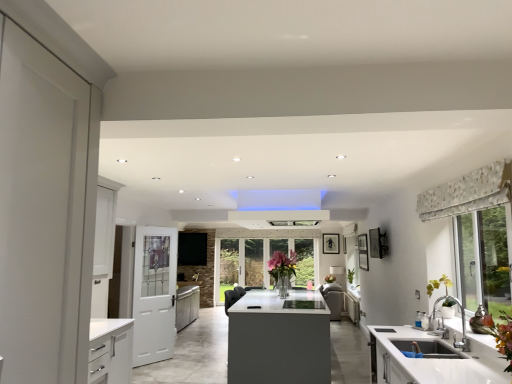
Locate an element on the screen. clear glass vase at center is located at coordinates (283, 285).

What do you see at coordinates (424, 359) in the screenshot? I see `white glossy sink at lower right` at bounding box center [424, 359].

The image size is (512, 384). What do you see at coordinates (154, 294) in the screenshot?
I see `white matte door at left` at bounding box center [154, 294].

I want to click on white matte door at left, so click(x=154, y=294).

You are a GUI agent. You are given a task and a screenshot of the screen. Output one action in this format:
    pyautogui.click(x=<x>, y=<y>)
    Task: Click on the white glossy cabinet at center
    
    Given the screenshot: What is the action you would take?
    pyautogui.click(x=352, y=307)

Measure the distance from green matte plant at right to patterned fabric valance at upper right.

3.41 feet.

At what (x,y) coordinates should I click in order to perform the action: click on curtain in front of the green matte plant at right. Please return your answer as a coordinate pair (x, y). Image resolution: width=512 pixels, height=384 pixels. Looking at the image, I should click on (468, 192).

Is green matte plant at right located outside patterned fabric valance at upper right?

green matte plant at right is positioned outside patterned fabric valance at upper right.

Which is in front, point (448, 305) or point (418, 194)?

The point (448, 305) is closer.

What's the angular difference between patterned fabric valance at upper right and clear glass vase at center's facing directions?

They differ by 0.958 degrees in their facing directions.

Does patterned fabric valance at upper right turn towards clear glass vase at center?

No, patterned fabric valance at upper right is not facing towards clear glass vase at center.

Which of these two, patterned fabric valance at upper right or clear glass vase at center, is smaller?

With smaller size is patterned fabric valance at upper right.

In the scene shown: Is patterned fabric valance at upper right inside the boundaries of clear glass vase at center, or outside?

patterned fabric valance at upper right is outside clear glass vase at center.

In the image, is white glossy cabinet at center on the left side or the right side of clear glass vase at center?

From the image, it's evident that white glossy cabinet at center is to the right of clear glass vase at center.

How many degrees apart are the facing directions of white glossy cabinet at center and clear glass vase at center?

1.69 degrees separate the facing orientations of white glossy cabinet at center and clear glass vase at center.

From the image's perspective, who appears lower, white glossy cabinet at center or clear glass vase at center?

white glossy cabinet at center is shown below in the image.

Does point (349, 303) come in front of point (283, 284)?

That is True.

From the image's perspective, is clear glass vase at center on top of green matte plant at right?

Incorrect, from the image's perspective, clear glass vase at center is lower than green matte plant at right.

Between point (287, 295) and point (445, 283), which one is positioned in front?

The point (445, 283) is closer.

From a real-world perspective, is clear glass vase at center physically below green matte plant at right?

Yes, from a real-world perspective, clear glass vase at center is below green matte plant at right.

Locate an element on the screen. Image resolution: width=512 pixels, height=384 pixels. vase that is under the green matte plant at right (from a real-world perspective) is located at coordinates (283, 285).

Is patterned fabric valance at upper right behind white glossy sink at lower right?

No, patterned fabric valance at upper right is in front of white glossy sink at lower right.

Considering the relative sizes of patterned fabric valance at upper right and white glossy sink at lower right in the image provided, is patterned fabric valance at upper right wider than white glossy sink at lower right?

Incorrect, the width of patterned fabric valance at upper right does not surpass that of white glossy sink at lower right.

This screenshot has width=512, height=384. Find the location of `curtain above the white glossy sink at lower right (from a real-world perspective)`. curtain above the white glossy sink at lower right (from a real-world perspective) is located at coordinates (468, 192).

From a real-world perspective, which is physically below, patterned fabric valance at upper right or white glossy sink at lower right?

From a 3D spatial view, white glossy sink at lower right is below.

Image resolution: width=512 pixels, height=384 pixels. Find the location of `vase on the left of the green matte plant at right`. vase on the left of the green matte plant at right is located at coordinates (283, 285).

Based on their sizes in the image, would you say green matte plant at right is bigger or smaller than clear glass vase at center?

green matte plant at right is smaller than clear glass vase at center.

Which object is positioned more to the right, green matte plant at right or clear glass vase at center?

green matte plant at right.

Is point (349, 312) less distant than point (451, 304)?

That is False.

From a real-world perspective, which object rests below the other?

white glossy cabinet at center, from a real-world perspective.

Is white glossy cabinet at center not close to green matte plant at right?

Indeed, white glossy cabinet at center is not near green matte plant at right.

Identify the location of curtain above the green matte plant at right (from a real-world perspective). point(468,192).

You are a GUI agent. You are given a task and a screenshot of the screen. Output one action in this format:
    pyautogui.click(x=<x>, y=<y>)
    Task: Click on the curtain in front of the clear glass vase at center
    The width and height of the screenshot is (512, 384).
    Given the screenshot: What is the action you would take?
    pyautogui.click(x=468, y=192)

From the image, which object appears to be nearer to white glossy sink at lower right, patterned fabric valance at upper right or clear glass vase at center?

patterned fabric valance at upper right.

Which object lies further to the anchor point white glossy cabinet at center, white matte door at left or clear glass vase at center?

white matte door at left is further to white glossy cabinet at center.

Looking at the image, which one is located closer to clear glass vase at center, white glossy sink at lower right or white matte door at left?

white matte door at left is closer to clear glass vase at center.

Looking at the image, which one is located closer to white glossy cabinet at center, clear glass vase at center or green matte plant at right?

clear glass vase at center.

Considering their positions, is clear glass vase at center positioned further to white glossy sink at lower right than green matte plant at right?

clear glass vase at center lies further to white glossy sink at lower right than the other object.

Considering their positions, is white matte door at left positioned closer to clear glass vase at center than green matte plant at right?

white matte door at left is closer to clear glass vase at center.

From the image, which object appears to be farther from patterned fabric valance at upper right, clear glass vase at center or white glossy sink at lower right?

clear glass vase at center is positioned further to the anchor patterned fabric valance at upper right.

Consider the image. Looking at the image, which one is located further to green matte plant at right, patterned fabric valance at upper right or white glossy cabinet at center?

Among the two, white glossy cabinet at center is located further to green matte plant at right.

What are the coordinates of `curtain between white matte door at left and green matte plant at right in the horizontal direction` in the screenshot? It's located at (468, 192).

Image resolution: width=512 pixels, height=384 pixels. What are the coordinates of `plant between white glossy sink at lower right and clear glass vase at center along the z-axis` in the screenshot? It's located at (439, 285).

Where is `plant positioned between patterned fabric valance at upper right and white glossy cabinet at center from near to far`? plant positioned between patterned fabric valance at upper right and white glossy cabinet at center from near to far is located at coordinates (439, 285).

Where is `countertop between patterned fabric valance at upper right and white glossy cabinet at center in the front-back direction`? The width and height of the screenshot is (512, 384). countertop between patterned fabric valance at upper right and white glossy cabinet at center in the front-back direction is located at coordinates (424, 359).